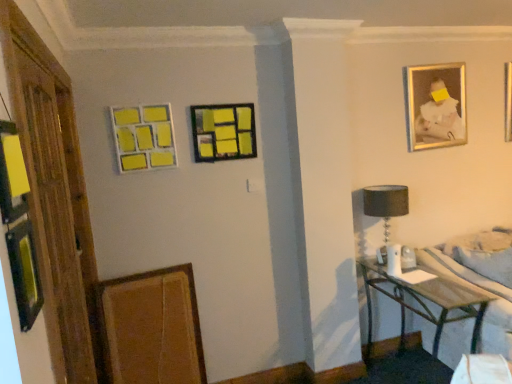
Question: Considering the relative positions of metallic silver table at lower right and gold-framed photo at upper right, the 4th picture frame from the left, in the image provided, is metallic silver table at lower right in front of gold-framed photo at upper right, the 4th picture frame from the left,?

Choices:
 (A) yes
 (B) no

Answer: (A)

Question: Does metallic silver table at lower right have a greater height compared to gold-framed photo at upper right, the fourth picture frame in the bottom-to-top sequence?

Choices:
 (A) no
 (B) yes

Answer: (B)

Question: Does metallic silver table at lower right have a lesser height compared to gold-framed photo at upper right, positioned as the 1th picture frame in right-to-left order?

Choices:
 (A) yes
 (B) no

Answer: (B)

Question: Could you tell me if metallic silver table at lower right is facing gold-framed photo at upper right, the 4th picture frame from the left?

Choices:
 (A) no
 (B) yes

Answer: (A)

Question: Is metallic silver table at lower right facing away from gold-framed photo at upper right, positioned as the 1th picture frame in right-to-left order?

Choices:
 (A) yes
 (B) no

Answer: (B)

Question: Does point (418, 122) appear closer or farther from the camera than point (242, 145)?

Choices:
 (A) farther
 (B) closer

Answer: (A)

Question: In the image, is gold-framed photo at upper right, the 4th picture frame from the left, positioned in front of or behind matte black picture frame at center, arranged as the 2th picture frame when viewed from the right?

Choices:
 (A) front
 (B) behind

Answer: (B)

Question: Visually, is gold-framed photo at upper right, the fourth picture frame in the bottom-to-top sequence, positioned to the left or to the right of matte black picture frame at center, which appears as the third picture frame when viewed from the left?

Choices:
 (A) left
 (B) right

Answer: (B)

Question: From the image's perspective, is gold-framed photo at upper right, the 4th picture frame from the left, above or below matte black picture frame at center, which appears as the third picture frame when viewed from the left?

Choices:
 (A) above
 (B) below

Answer: (A)

Question: Considering the relative positions of black fabric lampshade at right and yellow matte picture frame at upper left, which is the 2th picture frame from bottom to top, in the image provided, is black fabric lampshade at right to the left or to the right of yellow matte picture frame at upper left, which is the 2th picture frame from bottom to top,?

Choices:
 (A) left
 (B) right

Answer: (B)

Question: Considering their positions, is black fabric lampshade at right located in front of or behind yellow matte picture frame at upper left, which is counted as the 3th picture frame, starting from the top?

Choices:
 (A) front
 (B) behind

Answer: (B)

Question: In terms of height, does black fabric lampshade at right look taller or shorter compared to yellow matte picture frame at upper left, which is the 2th picture frame from bottom to top?

Choices:
 (A) tall
 (B) short

Answer: (A)

Question: From a real-world perspective, is black fabric lampshade at right positioned above or below yellow matte picture frame at upper left, which is the 1th picture frame in left-to-right order?

Choices:
 (A) above
 (B) below

Answer: (B)

Question: Which is correct: wooden bed frame at lower right is inside wooden textured picture frame at lower left, the first picture frame from the bottom, or outside of it?

Choices:
 (A) inside
 (B) outside

Answer: (B)

Question: Is wooden bed frame at lower right wider or thinner than wooden textured picture frame at lower left, the first picture frame from the bottom?

Choices:
 (A) thin
 (B) wide

Answer: (B)